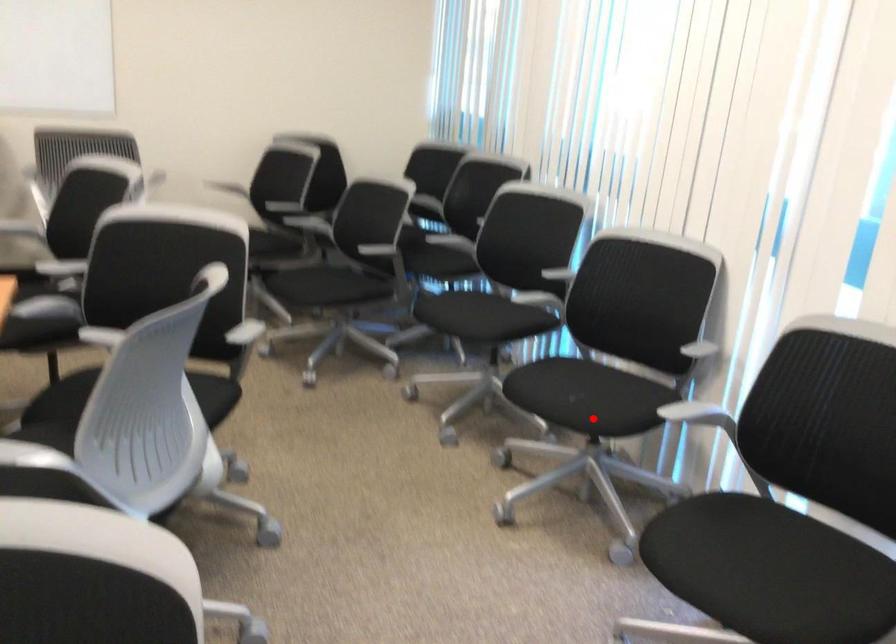
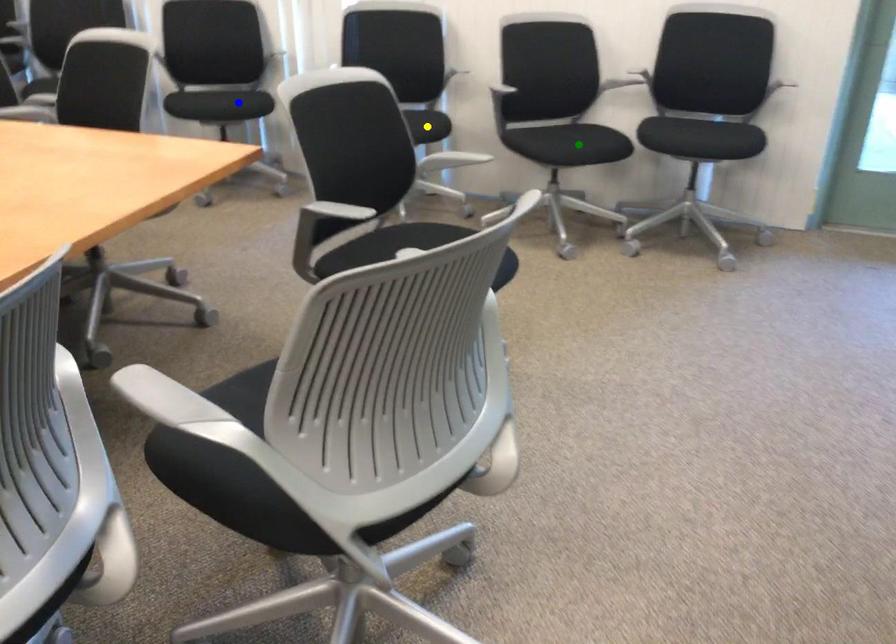
Question: I am providing you with two images of the same scene from different viewpoints. A red point is marked on the first image. You are given multiple points on the second image. Which point in image 2 is actually the same real-world point as the red point in image 1?

Choices:
 (A) blue point
 (B) green point
 (C) yellow point

Answer: (A)